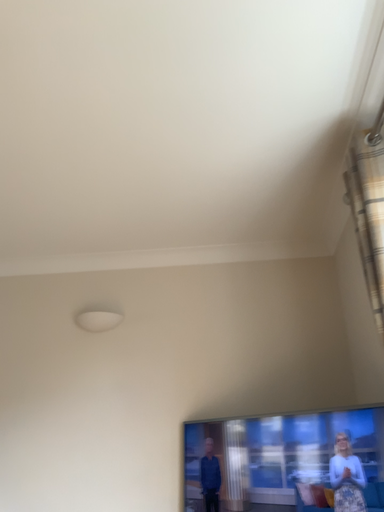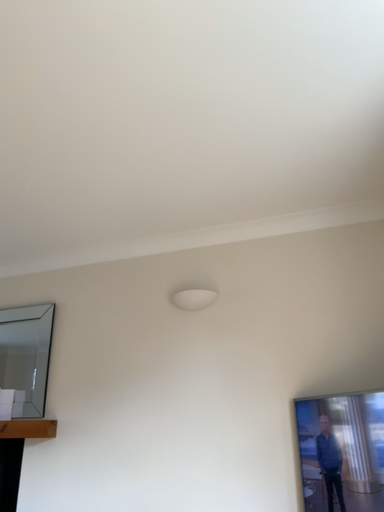
Question: Which way did the camera rotate in the video?

Choices:
 (A) rotated left
 (B) rotated right

Answer: (A)